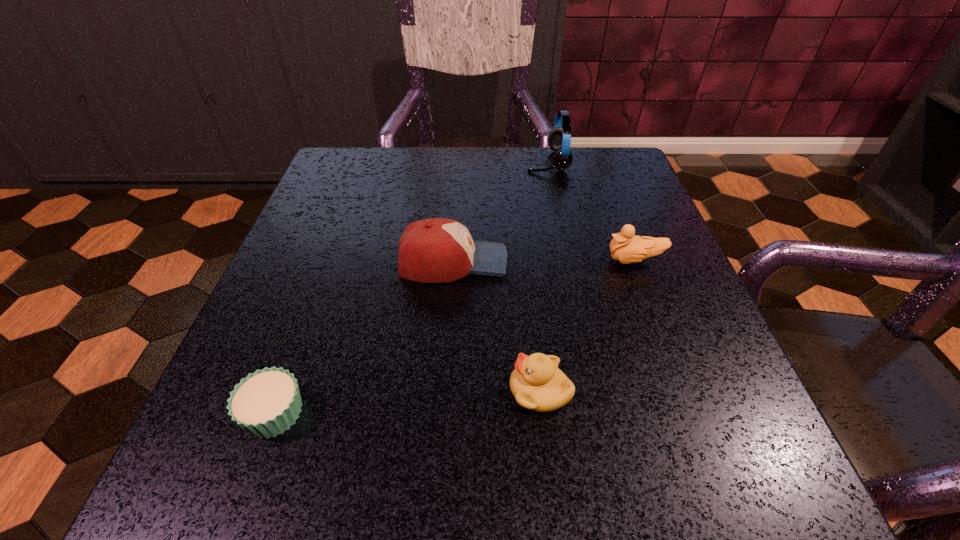
The height and width of the screenshot is (540, 960). In the image, there is a desktop. Identify the location of vacant space at the far right corner. (606, 187).

Locate an element on the screen. The width and height of the screenshot is (960, 540). vacant space that is in between the left duckling and the tallest object is located at coordinates (543, 275).

In order to click on free space between the rightmost object and the baseball cap in this screenshot , I will do pos(543,261).

You are a GUI agent. You are given a task and a screenshot of the screen. Output one action in this format:
    pyautogui.click(x=<x>, y=<y>)
    Task: Click on the unoccupied position between the baseball cap and the right duckling
    
    Given the screenshot: What is the action you would take?
    pyautogui.click(x=543, y=261)

Image resolution: width=960 pixels, height=540 pixels. In order to click on empty space between the baseball cap and the left duckling in this screenshot , I will do `click(496, 326)`.

Where is `vacant region between the left duckling and the baseball cap`? vacant region between the left duckling and the baseball cap is located at coordinates (496, 326).

Locate an element on the screen. Image resolution: width=960 pixels, height=540 pixels. free point between the farthest object and the rightmost object is located at coordinates (590, 211).

You are a GUI agent. You are given a task and a screenshot of the screen. Output one action in this format:
    pyautogui.click(x=<x>, y=<y>)
    Task: Click on the free space between the cupcake and the farthest object
    The height and width of the screenshot is (540, 960).
    Given the screenshot: What is the action you would take?
    pyautogui.click(x=410, y=287)

The image size is (960, 540). What are the coordinates of `free point between the baseball cap and the farther duckling` in the screenshot? It's located at (543, 261).

At what (x,y) coordinates should I click in order to perform the action: click on free point between the rightmost object and the shortest object. Please return your answer as a coordinate pair (x, y). This screenshot has height=540, width=960. Looking at the image, I should click on (454, 336).